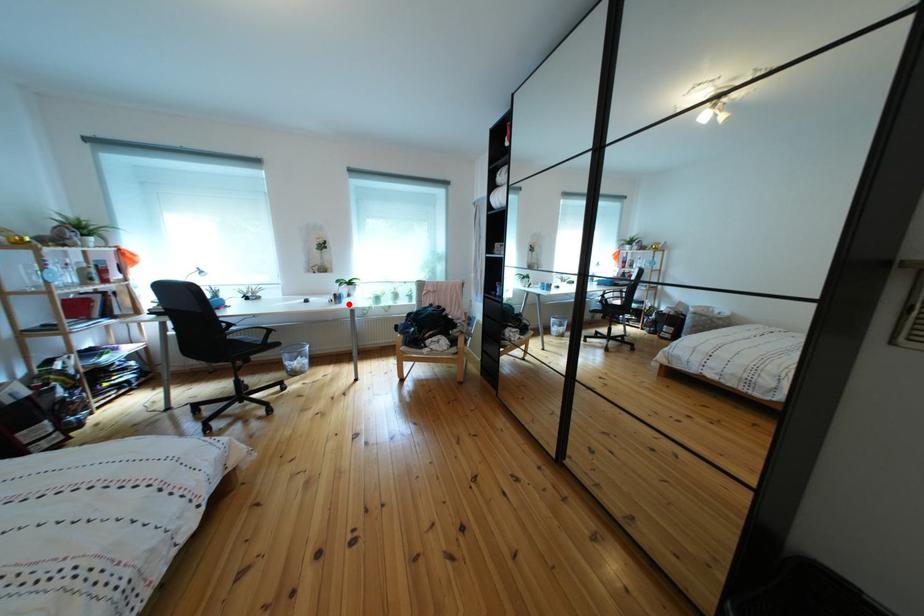
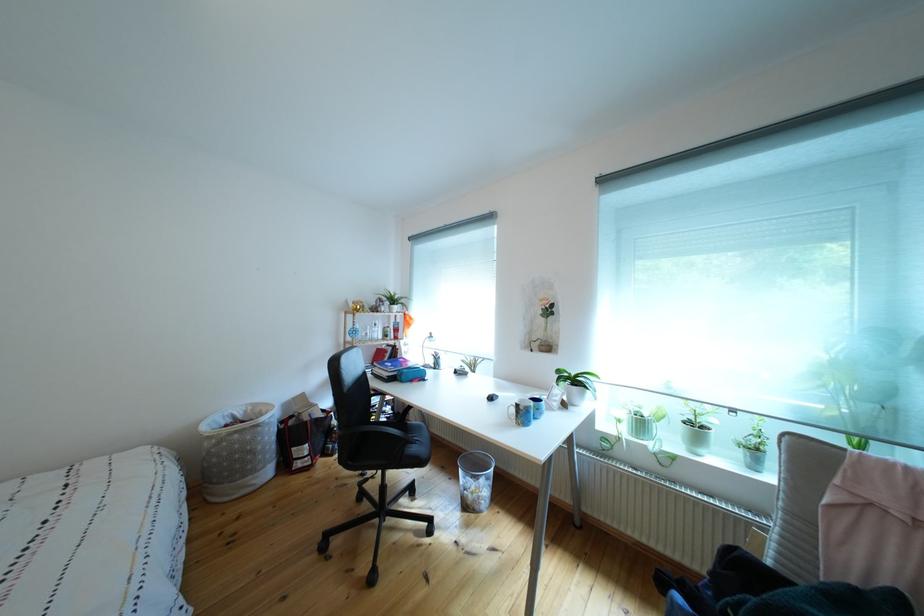
Where in the second image is the point corresponding to the highlighted location from the first image?

(533, 419)